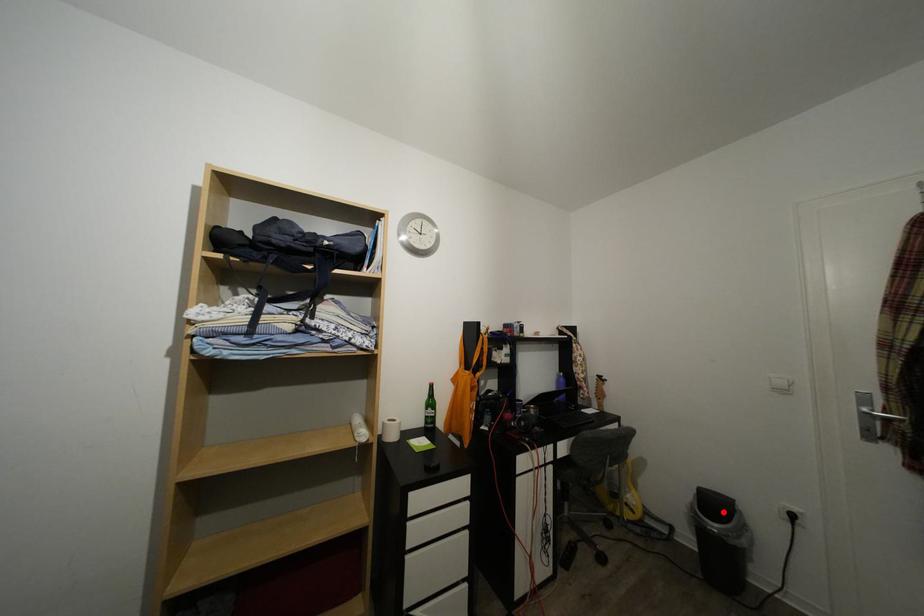
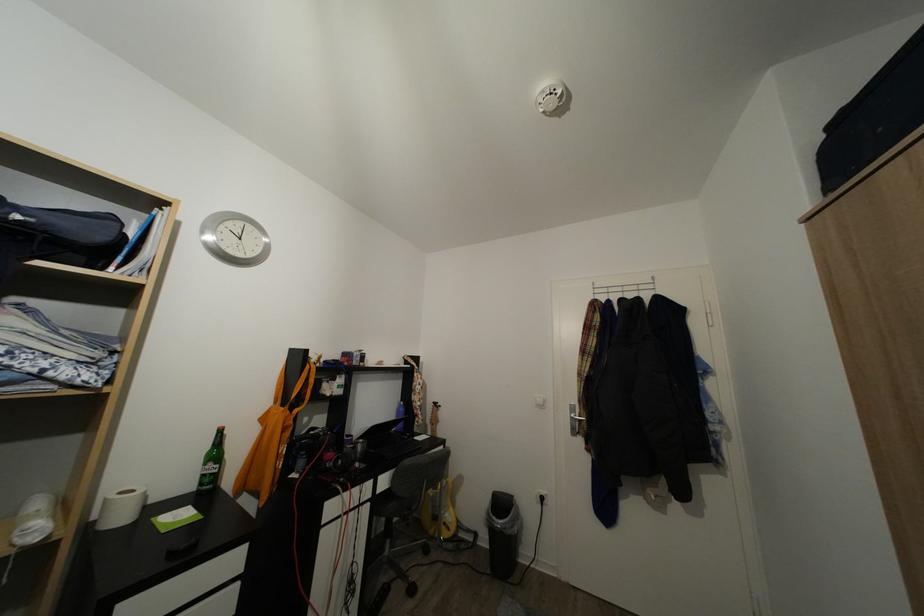
Where in the second image is the point corresponding to the highlighted location from the first image?

(509, 511)